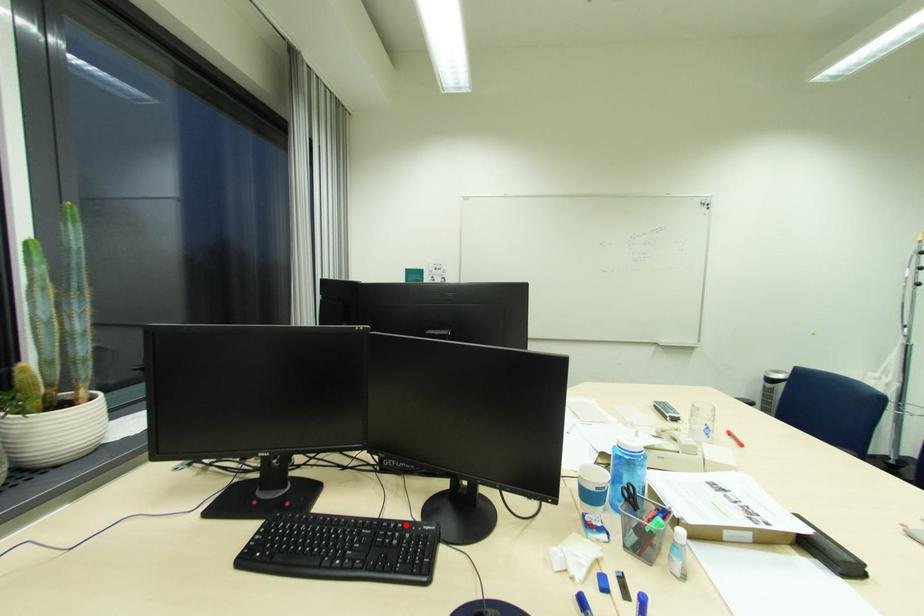
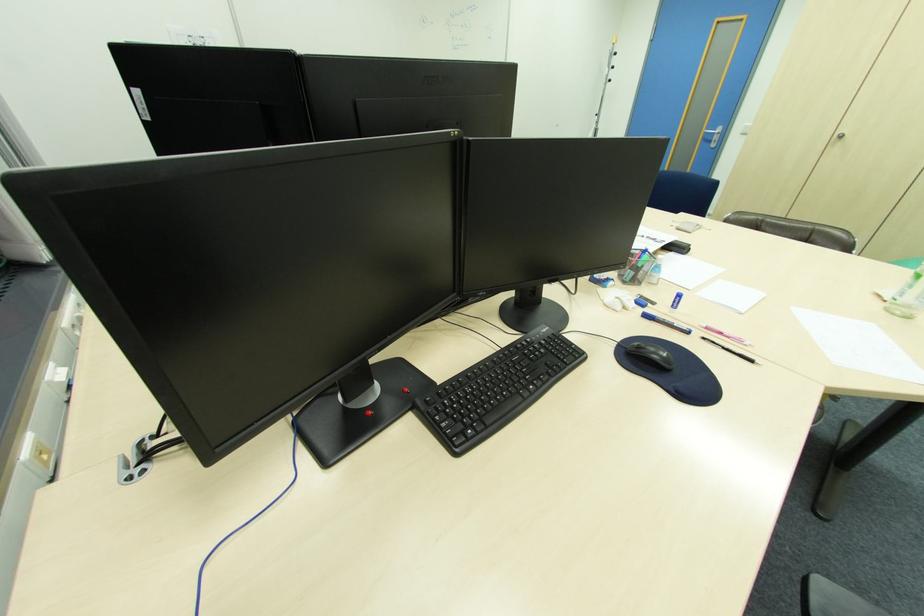
The point at the highlighted location is marked in the first image. Where is the corresponding point in the second image?

(533, 339)